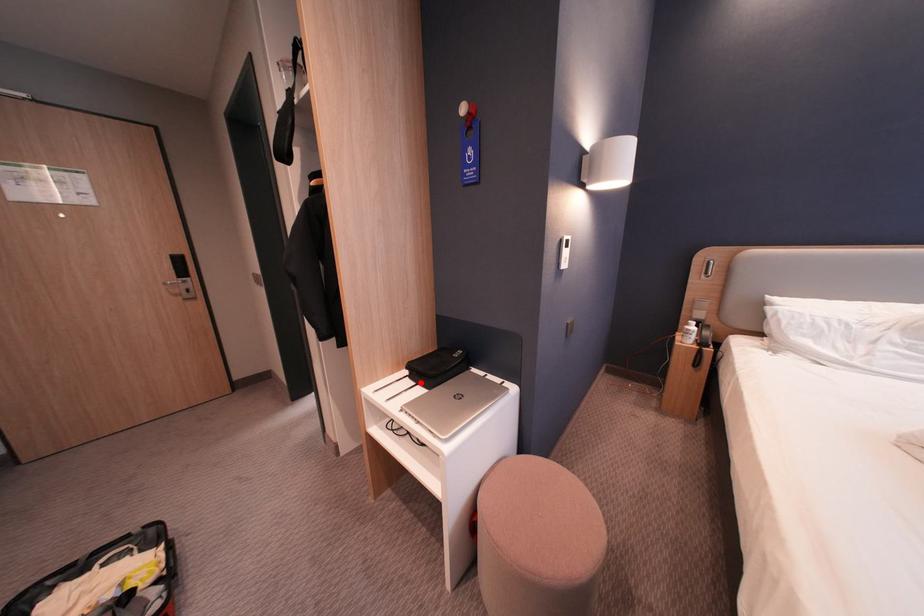
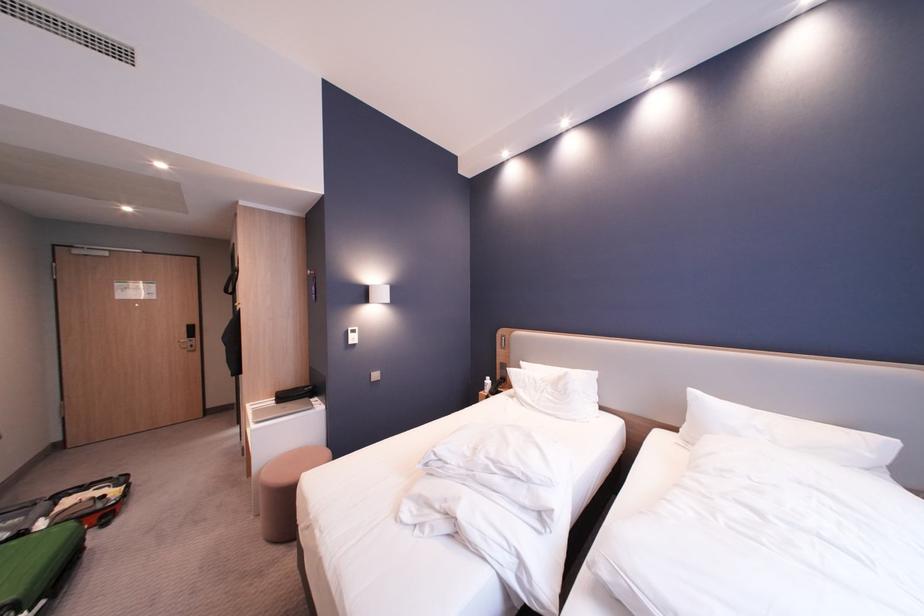
Locate, in the second image, the point that corresponds to the highlighted location in the first image.

(285, 403)